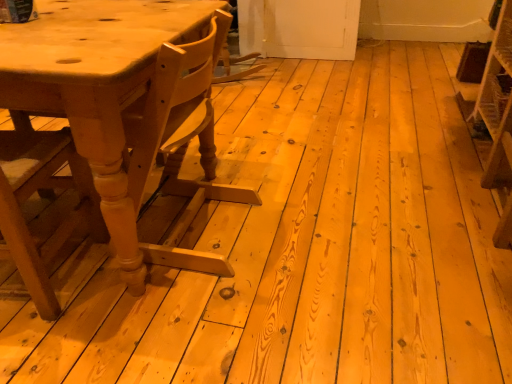
The width and height of the screenshot is (512, 384). What are the coordinates of `vacant area that lies to the right of light brown wood table at left` in the screenshot? It's located at (317, 223).